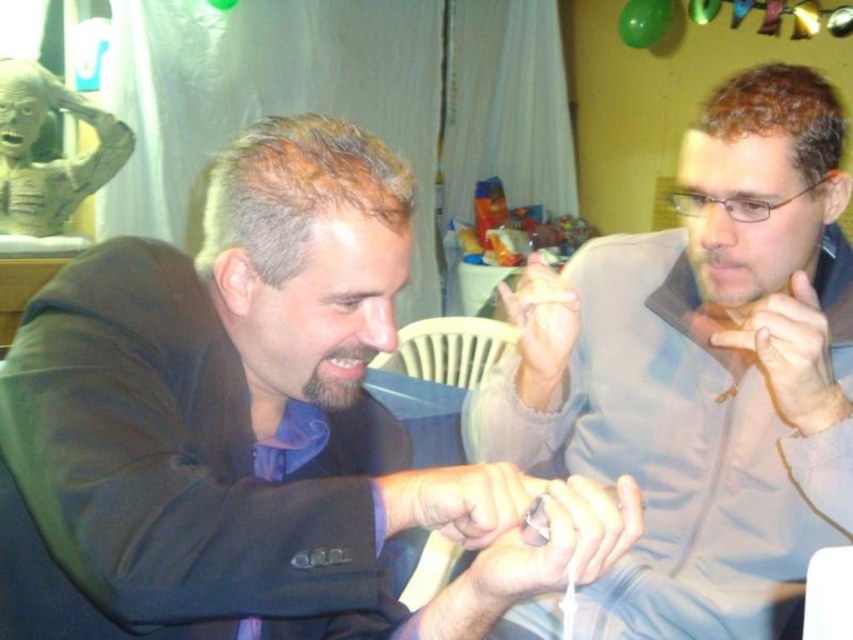
Question: Does matte black jacket at left appear on the right side of light brown leather jacket at right?

Choices:
 (A) yes
 (B) no

Answer: (B)

Question: Among these objects, which one is nearest to the camera?

Choices:
 (A) light brown leather jacket at right
 (B) matte black jacket at left

Answer: (B)

Question: Is matte black jacket at left positioned before light brown leather jacket at right?

Choices:
 (A) no
 (B) yes

Answer: (B)

Question: Which of the following is the farthest from the observer?

Choices:
 (A) (106, 595)
 (B) (805, 541)

Answer: (B)

Question: Is matte black jacket at left to the left of light brown leather jacket at right from the viewer's perspective?

Choices:
 (A) yes
 (B) no

Answer: (A)